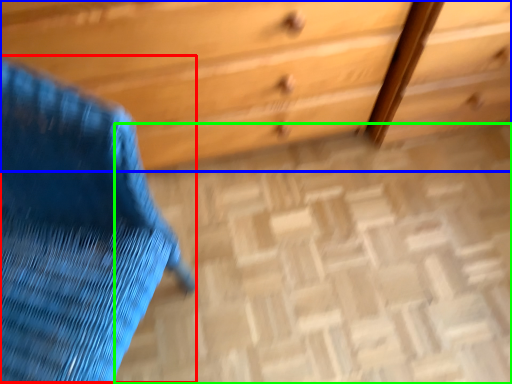
Question: Which is nearer to the swivel chair (highlighted by a red box)? chest of drawers (highlighted by a blue box) or plain (highlighted by a green box).

Choices:
 (A) chest of drawers
 (B) plain

Answer: (A)